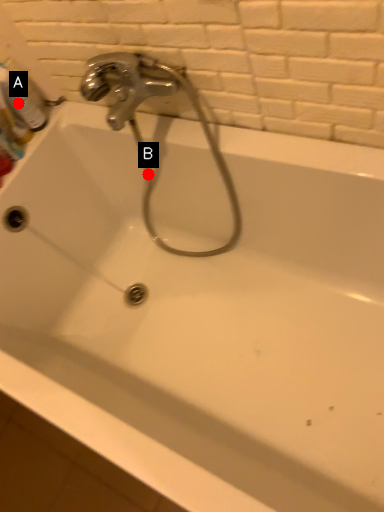
Question: Two points are circled on the image, labeled by A and B beside each circle. Which point is further to the camera?

Choices:
 (A) A is further
 (B) B is further

Answer: (B)